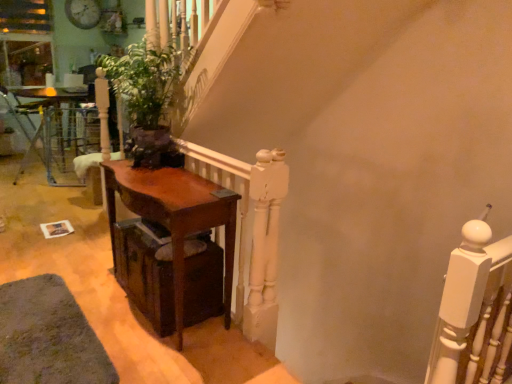
This screenshot has width=512, height=384. In order to click on free space to the left of mahogany wood table at center, the 1th table from the front in this screenshot , I will do `click(91, 286)`.